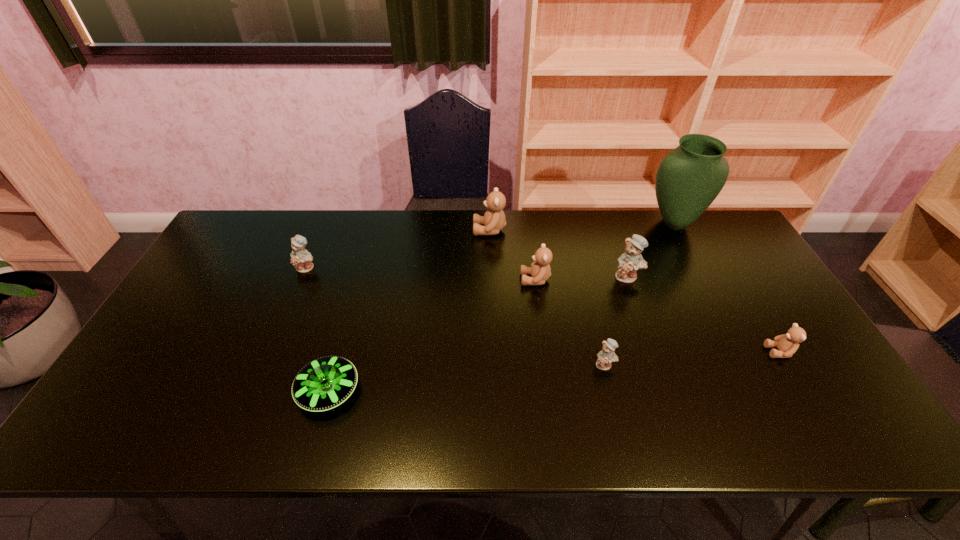
Identify the location of free region that satisfies the following two spatial constraints: 1. on the face of the fifth teddy bear from right to left; 2. on the front-facing side of the second smallest blue teddy bear. (491, 268).

You are a GUI agent. You are given a task and a screenshot of the screen. Output one action in this format:
    pyautogui.click(x=<x>, y=<y>)
    Task: Click on the free space that satisfies the following two spatial constraints: 1. on the front-facing side of the leftmost blue teddy bear; 2. on the left side of the shortest object
    This screenshot has height=540, width=960.
    Given the screenshot: What is the action you would take?
    pyautogui.click(x=255, y=392)